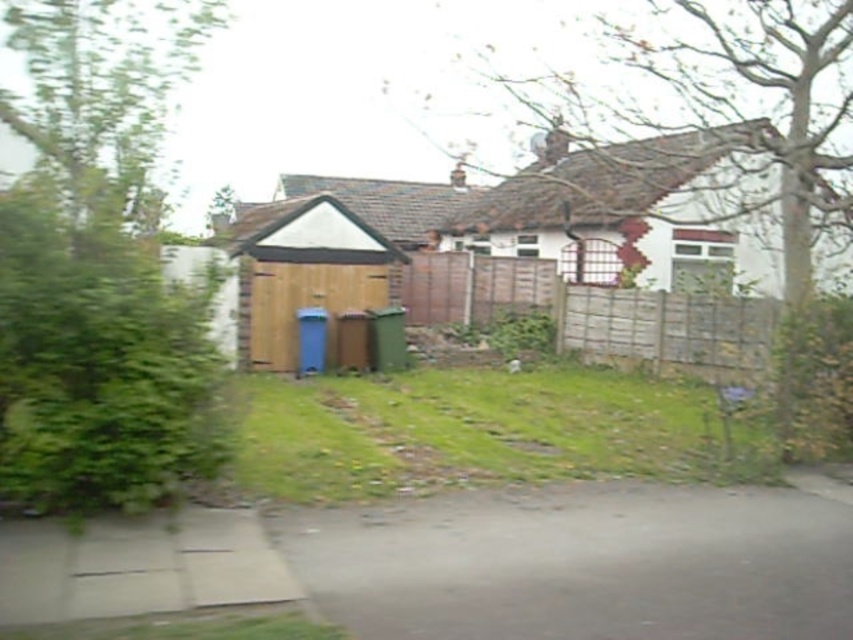
Question: Which of the following is the farthest from the observer?

Choices:
 (A) brown leafy tree at upper center
 (B) green leafy tree at left
 (C) green leafy tree at upper left

Answer: (A)

Question: Which point is closer to the camera?

Choices:
 (A) green leafy tree at left
 (B) green leafy tree at upper left

Answer: (A)

Question: Is green leafy tree at left to the right of green leafy tree at upper left from the viewer's perspective?

Choices:
 (A) no
 (B) yes

Answer: (B)

Question: From the image, what is the correct spatial relationship of green leafy tree at left in relation to green leafy tree at upper left?

Choices:
 (A) below
 (B) above

Answer: (A)

Question: Which point is farther to the camera?

Choices:
 (A) (125, 156)
 (B) (778, 429)
 (C) (20, 220)

Answer: (B)

Question: Does green leafy tree at left appear over brown leafy tree at upper center?

Choices:
 (A) no
 (B) yes

Answer: (A)